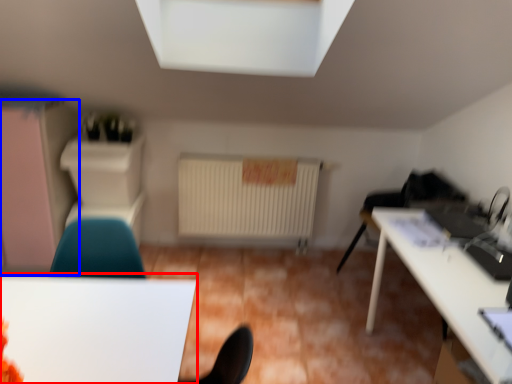
Question: Which point is further to the camera, table (highlighted by a red box) or dresser (highlighted by a blue box)?

Choices:
 (A) table
 (B) dresser

Answer: (B)